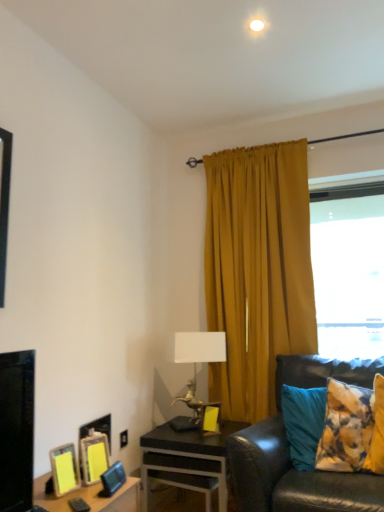
You are a GUI agent. You are given a task and a screenshot of the screen. Output one action in this format:
    pyautogui.click(x=<x>, y=<y>)
    Task: Click on the free space in front of metallic horse-shaped lamp at center
    Image resolution: width=384 pixels, height=512 pixels.
    Given the screenshot: What is the action you would take?
    pyautogui.click(x=195, y=437)